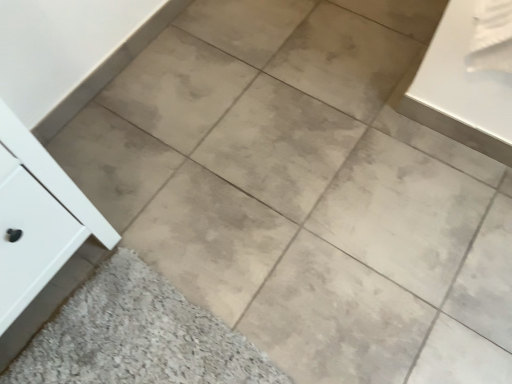
What do you see at coordinates (72, 253) in the screenshot? The width and height of the screenshot is (512, 384). I see `white matte cabinet at left` at bounding box center [72, 253].

Looking at this image, measure the distance between white matte cabinet at left and camera.

The depth of white matte cabinet at left is 74.46 centimeters.

This screenshot has width=512, height=384. I want to click on white matte cabinet at left, so click(x=72, y=253).

The height and width of the screenshot is (384, 512). What do you see at coordinates (137, 337) in the screenshot?
I see `beige matte tile at lower left` at bounding box center [137, 337].

Find the location of a particular element. beige matte tile at lower left is located at coordinates (137, 337).

Locate an element on the screen. white matte cabinet at left is located at coordinates (72, 253).

Which is more to the left, white matte cabinet at left or beige matte tile at lower left?

From the viewer's perspective, white matte cabinet at left appears more on the left side.

Considering the positions of objects white matte cabinet at left and beige matte tile at lower left in the image provided, who is behind, white matte cabinet at left or beige matte tile at lower left?

Answer: beige matte tile at lower left is further away from the camera.

Considering the points (92, 222) and (187, 360), which point is in front, point (92, 222) or point (187, 360)?

The point (92, 222) is closer to the camera.

From the image's perspective, who appears lower, white matte cabinet at left or beige matte tile at lower left?

beige matte tile at lower left.

From a real-world perspective, who is located higher, white matte cabinet at left or beige matte tile at lower left?

white matte cabinet at left, from a real-world perspective.

Which object is thinner, white matte cabinet at left or beige matte tile at lower left?

Thinner between the two is white matte cabinet at left.

Is white matte cabinet at left shorter than beige matte tile at lower left?

No.

Who is smaller, white matte cabinet at left or beige matte tile at lower left?

Smaller between the two is beige matte tile at lower left.

Is beige matte tile at lower left located within white matte cabinet at left?

No.

Is white matte cabinet at left not near beige matte tile at lower left?

No.

Consider the image. Is white matte cabinet at left looking in the opposite direction of beige matte tile at lower left?

white matte cabinet at left does not have its back to beige matte tile at lower left.

Can you tell me how much white matte cabinet at left and beige matte tile at lower left differ in facing direction?

The angular difference between white matte cabinet at left and beige matte tile at lower left is 0.154 degrees.

How distant is white matte cabinet at left from beige matte tile at lower left?

The distance of white matte cabinet at left from beige matte tile at lower left is 9.33 inches.

This screenshot has height=384, width=512. In order to click on cabinetry above the beige matte tile at lower left (from the image's perspective) in this screenshot , I will do tap(72, 253).

Is beige matte tile at lower left to the left or to the right of white matte cabinet at left in the image?

Based on their positions, beige matte tile at lower left is located to the right of white matte cabinet at left.

Which object is more forward, beige matte tile at lower left or white matte cabinet at left?

white matte cabinet at left is in front.

Considering the positions of points (168, 286) and (13, 345), is point (168, 286) closer to camera compared to point (13, 345)?

No.

Looking at this image, from the image's perspective, would you say beige matte tile at lower left is positioned over white matte cabinet at left?

No, from the image's perspective, beige matte tile at lower left is not on top of white matte cabinet at left.

From a real-world perspective, is beige matte tile at lower left over white matte cabinet at left?

No, from a real-world perspective, beige matte tile at lower left is not over white matte cabinet at left

Which of these two, beige matte tile at lower left or white matte cabinet at left, is thinner?

white matte cabinet at left is thinner.

Who is taller, beige matte tile at lower left or white matte cabinet at left?

white matte cabinet at left is taller.

From the picture: Between beige matte tile at lower left and white matte cabinet at left, which one has smaller size?

Smaller between the two is beige matte tile at lower left.

Choose the correct answer: Is beige matte tile at lower left inside white matte cabinet at left or outside it?

The correct answer is: outside.

Would you say beige matte tile at lower left is a long distance from white matte cabinet at left?

No, beige matte tile at lower left is not far away from white matte cabinet at left.

Is beige matte tile at lower left facing towards white matte cabinet at left?

No.

Can you tell me how much beige matte tile at lower left and white matte cabinet at left differ in facing direction?

0.154 degrees separate the facing orientations of beige matte tile at lower left and white matte cabinet at left.

I want to click on cabinetry that appears in front of the beige matte tile at lower left, so click(x=72, y=253).

Locate an element on the screen. The width and height of the screenshot is (512, 384). cabinetry located on the left of beige matte tile at lower left is located at coordinates (72, 253).

Image resolution: width=512 pixels, height=384 pixels. I want to click on ceramic tile behind the white matte cabinet at left, so click(x=137, y=337).